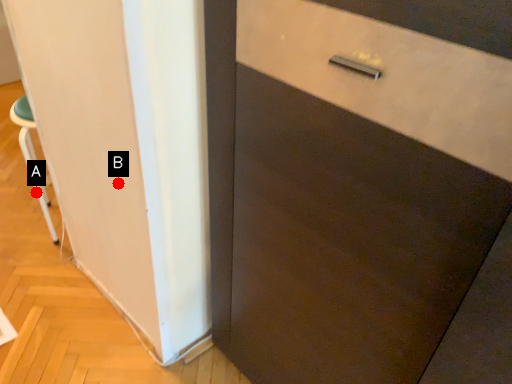
Question: Two points are circled on the image, labeled by A and B beside each circle. Which of the following is the closest to the observer?

Choices:
 (A) A is closer
 (B) B is closer

Answer: (B)